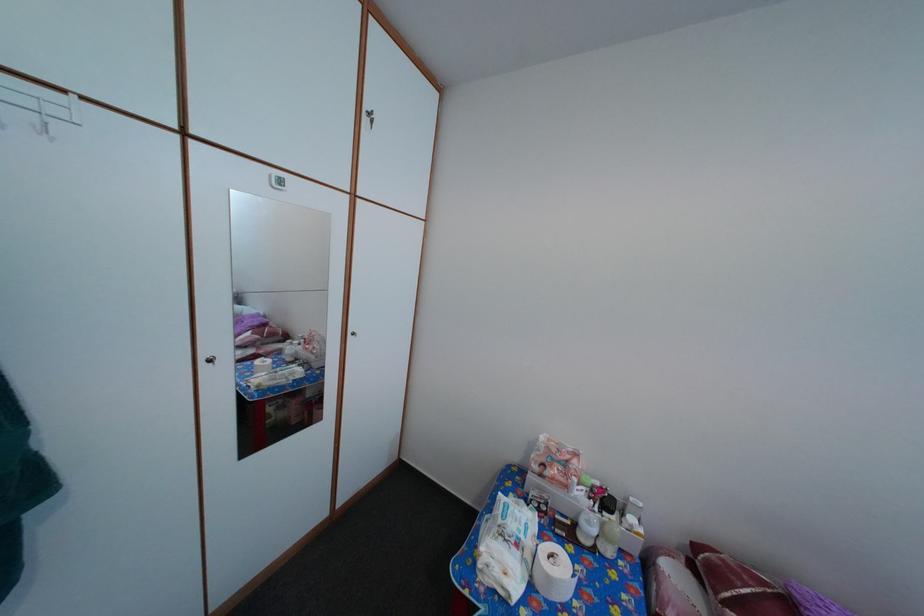
Find the location of `white hook rack`. white hook rack is located at coordinates (43, 107).